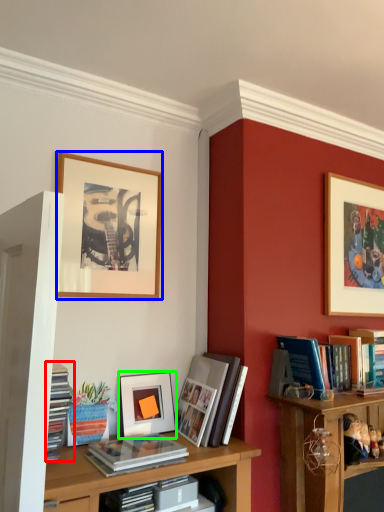
Question: Based on their relative distances, which object is farther from book (highlighted by a red box)? Choose from picture frame (highlighted by a blue box) and picture frame (highlighted by a green box).

Choices:
 (A) picture frame
 (B) picture frame

Answer: (A)